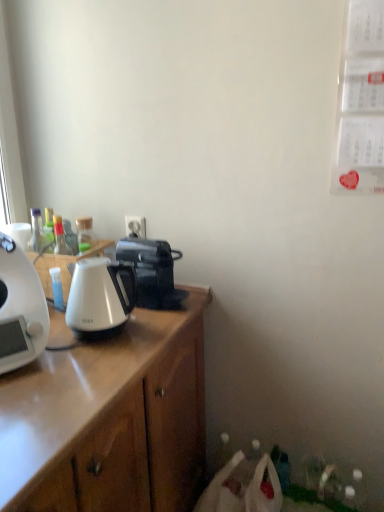
Question: Is black plastic coffee maker at upper center, marked as the 1th coffee maker in a back-to-front arrangement, spatially inside white glossy kettle at left, or outside of it?

Choices:
 (A) inside
 (B) outside

Answer: (B)

Question: Considering their positions, is black plastic coffee maker at upper center, the second coffee maker in the front-to-back sequence, located in front of or behind white glossy kettle at left?

Choices:
 (A) behind
 (B) front

Answer: (A)

Question: Which object is positioned closest to the white glossy kettle at left?

Choices:
 (A) white glossy coffee maker at left, marked as the first coffee maker in a front-to-back arrangement
 (B) white plastic power outlet at center
 (C) white glossy kettle at left
 (D) black plastic coffee maker at upper center, the 1th coffee maker in the right-to-left sequence

Answer: (B)

Question: Estimate the real-world distances between objects in this image. Which object is farther from the white glossy kettle at left?

Choices:
 (A) white plastic power outlet at center
 (B) white glossy coffee maker at left, marked as the first coffee maker in a front-to-back arrangement
 (C) white glossy kettle at left
 (D) black plastic coffee maker at upper center, marked as the 2th coffee maker in a left-to-right arrangement

Answer: (B)